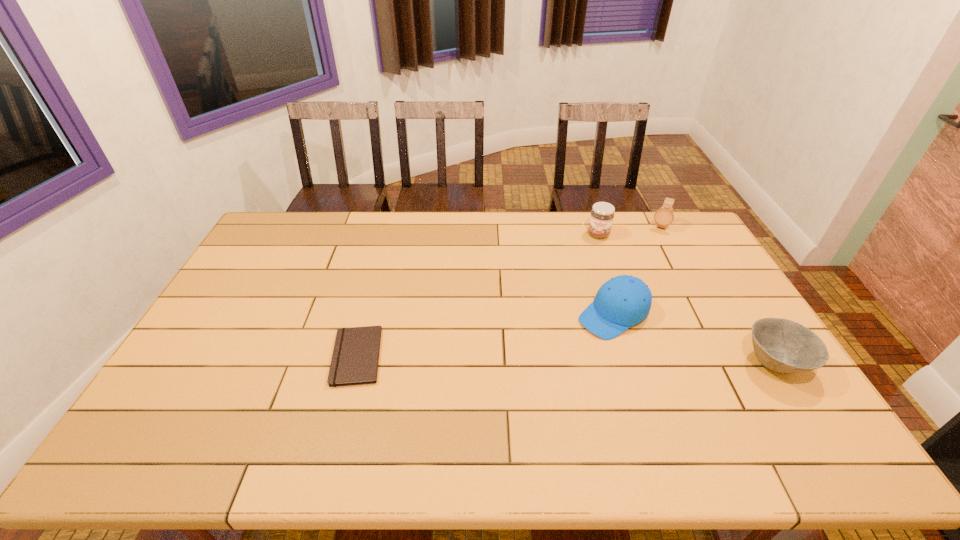
This screenshot has height=540, width=960. I want to click on bowl located in the right edge section of the desktop, so click(x=784, y=346).

At what (x,y) coordinates should I click in order to perform the action: click on watch that is positioned at the right edge. Please return your answer as a coordinate pair (x, y). The image size is (960, 540). Looking at the image, I should click on (664, 216).

This screenshot has width=960, height=540. In order to click on object present at the far right corner in this screenshot , I will do `click(664, 216)`.

Identify the location of object located in the near right corner section of the desktop. (784, 346).

This screenshot has height=540, width=960. Find the location of `vacant region at the far edge of the desktop`. vacant region at the far edge of the desktop is located at coordinates (516, 220).

Image resolution: width=960 pixels, height=540 pixels. In the image, there is a desktop. What are the coordinates of `vacant space at the left edge` in the screenshot? It's located at (253, 256).

Find the location of a particular element. vacant area at the right edge of the desktop is located at coordinates (702, 291).

The image size is (960, 540). What are the coordinates of `blank space at the far left corner` in the screenshot? It's located at (294, 233).

Find the location of `vacant region at the near left corner of the desktop`. vacant region at the near left corner of the desktop is located at coordinates (219, 389).

I want to click on free space between the leftmost object and the second shortest object, so click(566, 360).